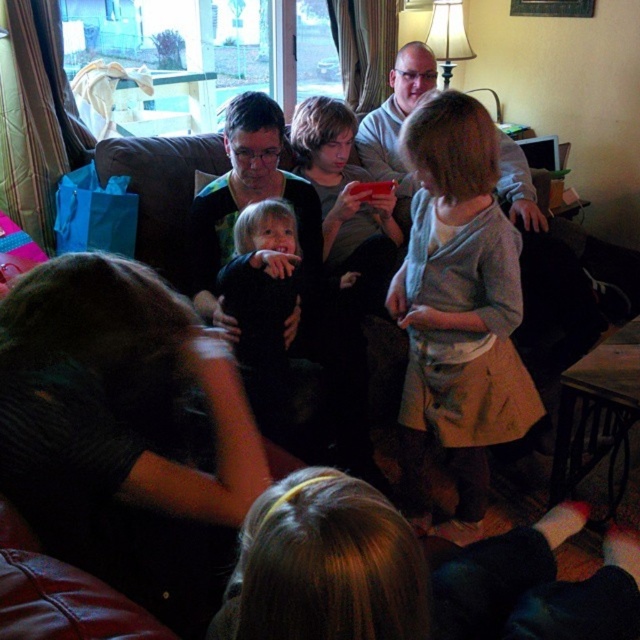
Which is below, dark brown leather couch at lower left or light gray knit sweater at center?

Positioned lower is dark brown leather couch at lower left.

Between dark brown leather couch at lower left and light gray knit sweater at center, which one appears on the left side from the viewer's perspective?

dark brown leather couch at lower left

Who is more forward, (x=144, y=522) or (x=433, y=292)?

Point (x=144, y=522)

Identify the location of dark brown leather couch at lower left. Image resolution: width=640 pixels, height=640 pixels. (124, 433).

Does point (305, 236) come farther from viewer compared to point (268, 212)?

That is True.

Which is above, matte black shirt at center or dark blue fabric baby at center?

matte black shirt at center is above.

The width and height of the screenshot is (640, 640). What are the coordinates of `matte black shirt at center` in the screenshot? It's located at (248, 202).

Identify the location of matte black shirt at center. This screenshot has height=640, width=640. (248, 202).

Does dark brown leather couch at lower left appear under matte black shirt at center?

Yes.

You are a GUI agent. You are given a task and a screenshot of the screen. Output one action in this format:
    pyautogui.click(x=<x>, y=<y>)
    Task: Click on the dark brown leather couch at lower left
    The width and height of the screenshot is (640, 640).
    Given the screenshot: What is the action you would take?
    pyautogui.click(x=124, y=433)